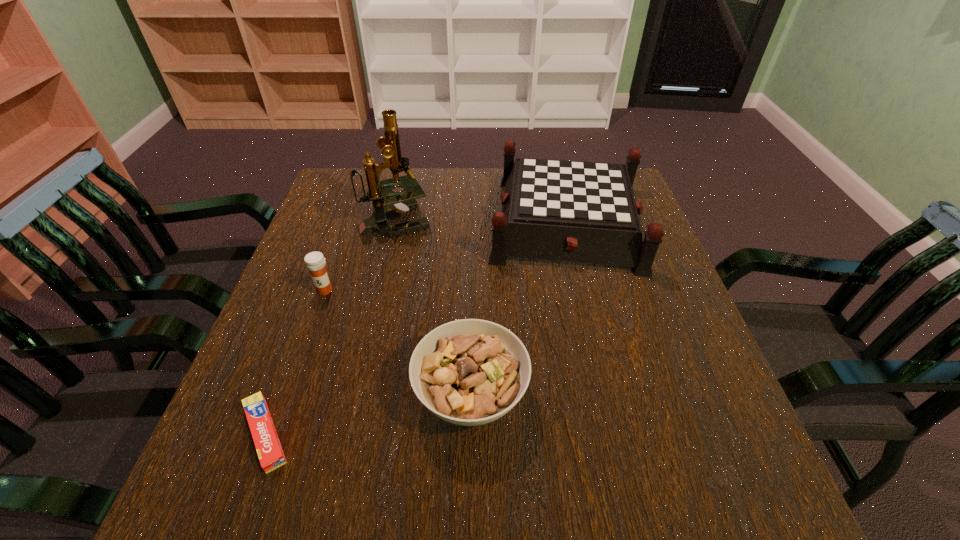
You are a GUI agent. You are given a task and a screenshot of the screen. Output one action in this format:
    pyautogui.click(x=<x>, y=<y>)
    Task: Click on the vacant position at the far edge of the desktop
    Image resolution: width=960 pixels, height=540 pixels.
    Given the screenshot: What is the action you would take?
    pyautogui.click(x=420, y=200)

Where is `free space at the near edge of the desktop`? This screenshot has width=960, height=540. free space at the near edge of the desktop is located at coordinates (620, 480).

You are a GUI agent. You are given a task and a screenshot of the screen. Output one action in this format:
    pyautogui.click(x=<x>, y=<y>)
    Task: Click on the free space at the left edge
    This screenshot has width=960, height=540.
    Given the screenshot: What is the action you would take?
    pyautogui.click(x=304, y=449)

Where is `free location at the right edge of the desktop`? Image resolution: width=960 pixels, height=540 pixels. free location at the right edge of the desktop is located at coordinates (709, 427).

Image resolution: width=960 pixels, height=540 pixels. Find the location of `vacant area at the far left corner`. vacant area at the far left corner is located at coordinates (328, 193).

I want to click on free space between the stew and the microscope, so click(x=433, y=307).

Find the location of a particular element. This screenshot has width=960, height=540. vacant region between the stew and the checkerboard is located at coordinates (519, 308).

Where is `vacant region between the microscope and the toothpaste`? vacant region between the microscope and the toothpaste is located at coordinates (330, 327).

Identify the location of blank region between the second tallest object and the medicine. This screenshot has height=540, width=960. (446, 256).

Where is `free space between the tallest object and the stew`? The height and width of the screenshot is (540, 960). free space between the tallest object and the stew is located at coordinates (433, 307).